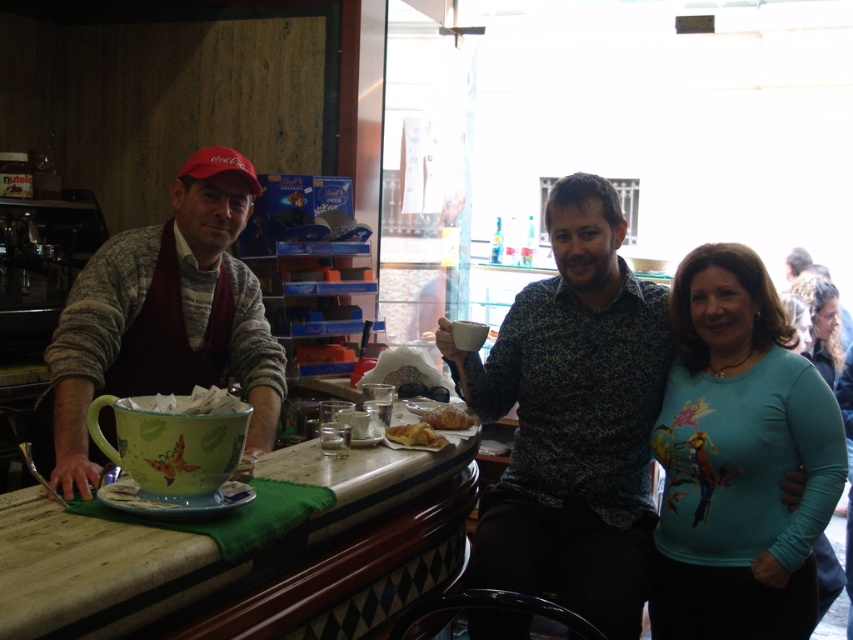
Where is the teal matte shirt at center located in the image?

The teal matte shirt at center is located at point (x=738, y=460) in the image.

You are a customer at the counter in the image. There are two points marked on the counter. One is at coordinates point (247, 365) and the other is at point (438, 416). Which of these points is closer to you as you stand at the counter?

Point (247, 365) is closer to you because it is further to the viewer than point (438, 416).

You are a customer standing at the counter in the image. You want to grab the teal matte shirt at center but need to know if you can reach it without moving your chair. Your arms can extend 1.5 meters. Can you reach it?

The teal matte shirt at center is 1.78 meters away from you, which is beyond your arm reach of 1.5 meters. You cannot reach it without moving closer.